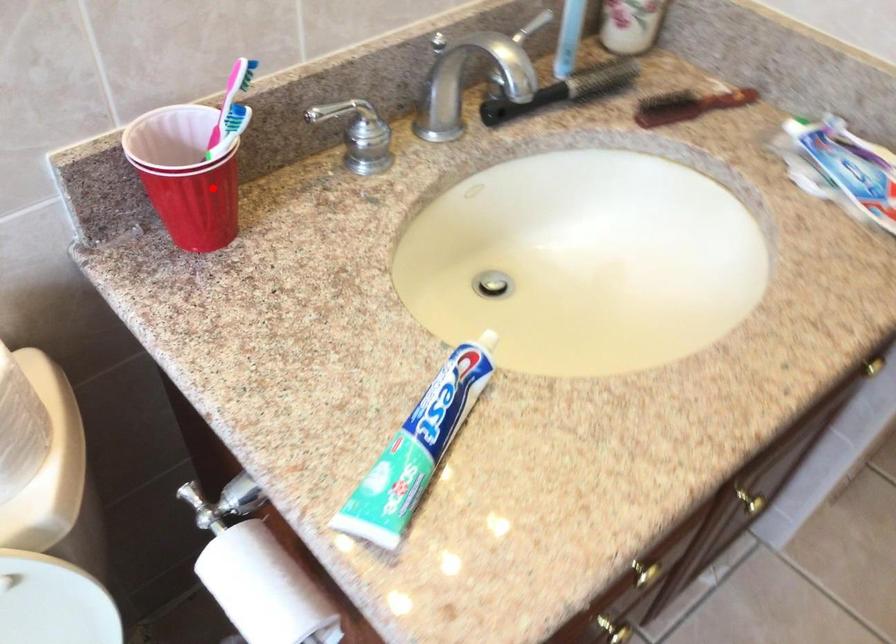
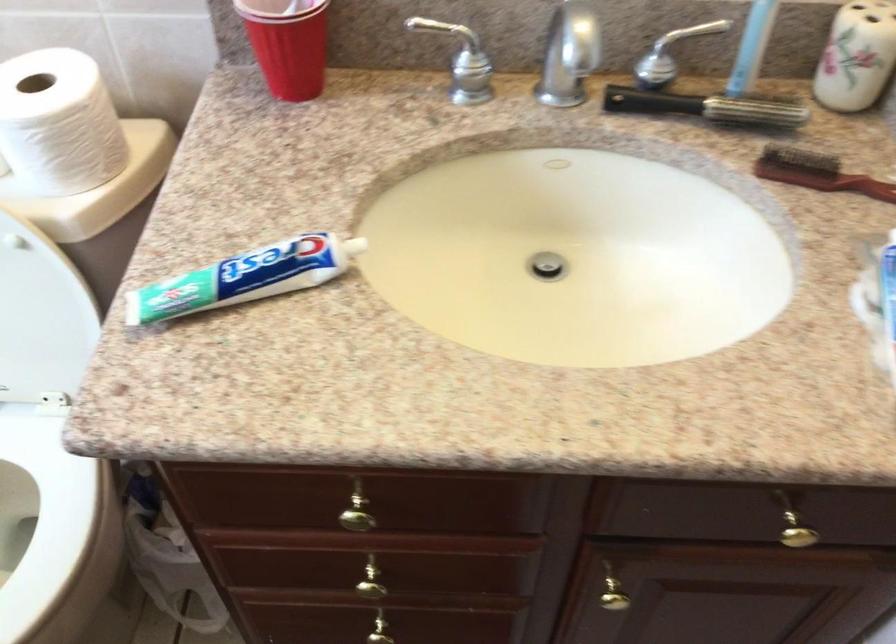
Locate, in the second image, the point that corresponds to the highlighted location in the first image.

(288, 44)